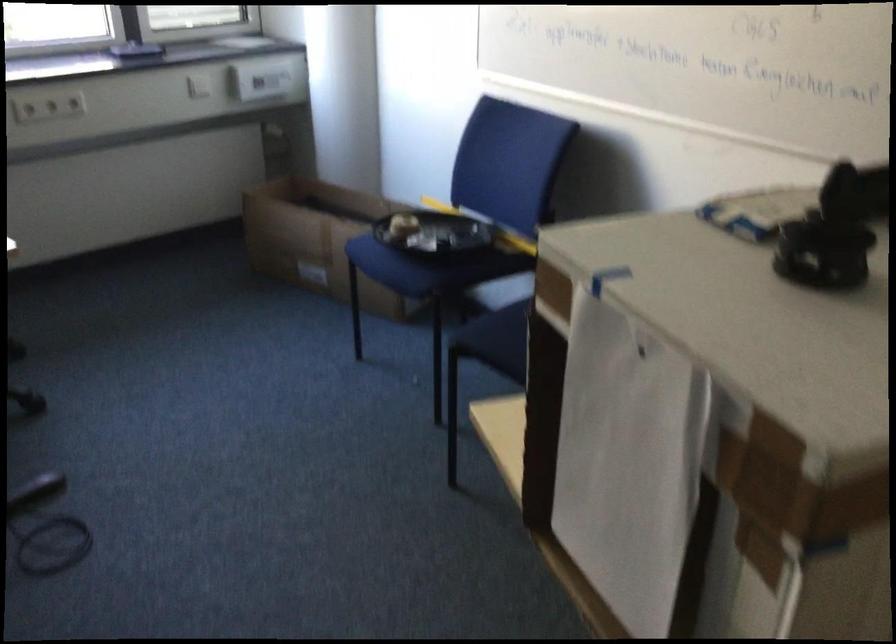
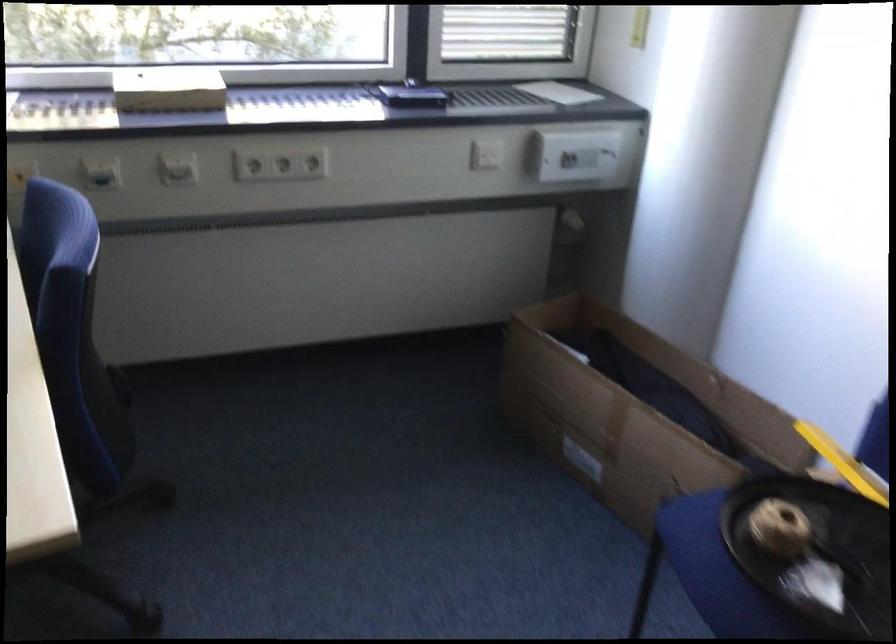
In the second image, find the point that corresponds to [277,137] in the first image.

(570, 225)